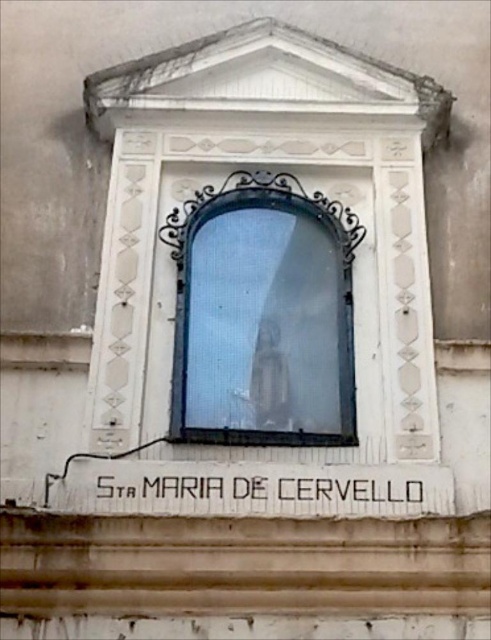
Question: Among these objects, which one is nearest to the camera?

Choices:
 (A) clear glass statue at center
 (B) black painted wood sign at center

Answer: (B)

Question: Which point is closer to the camera?

Choices:
 (A) clear glass statue at center
 (B) black painted wood sign at center

Answer: (B)

Question: Does clear glass statue at center lie behind black painted wood sign at center?

Choices:
 (A) no
 (B) yes

Answer: (B)

Question: Can you confirm if clear glass statue at center is bigger than black painted wood sign at center?

Choices:
 (A) yes
 (B) no

Answer: (B)

Question: Is clear glass statue at center bigger than black painted wood sign at center?

Choices:
 (A) yes
 (B) no

Answer: (B)